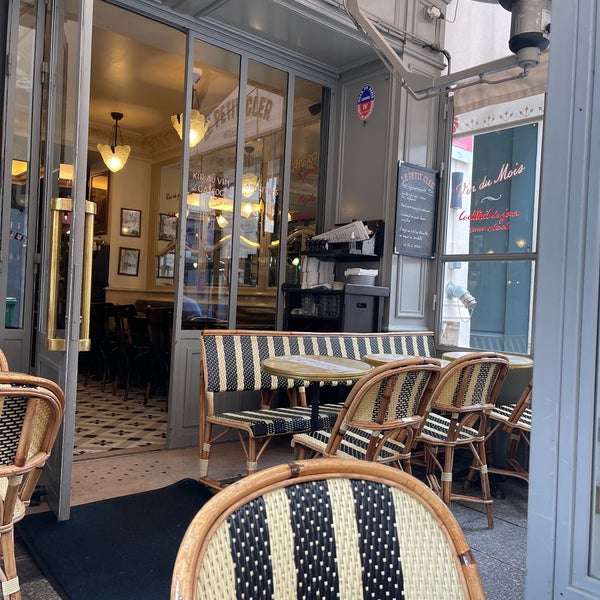
Locate an element on the screen. dining chairs is located at coordinates (330, 549), (397, 402), (469, 390), (517, 415), (34, 424).